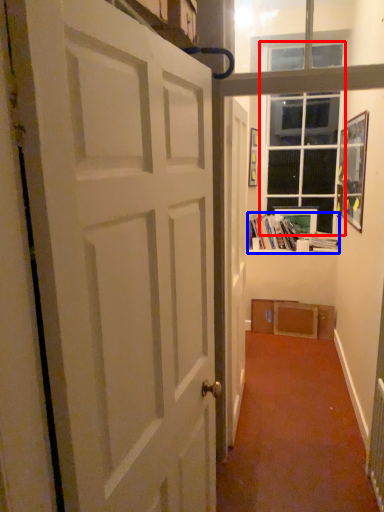
Question: Which point is further to the camera, window (highlighted by a red box) or book (highlighted by a blue box)?

Choices:
 (A) window
 (B) book

Answer: (B)